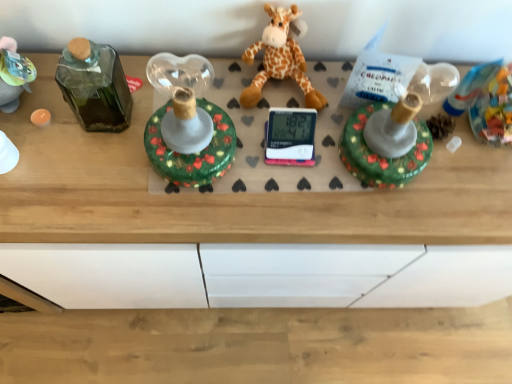
Identify the location of shiny green glass candlestick at center. (187, 123).

Describe the element at coordinates (187, 123) in the screenshot. The width and height of the screenshot is (512, 384). I see `shiny green glass candlestick at center` at that location.

The width and height of the screenshot is (512, 384). What do you see at coordinates (280, 59) in the screenshot? I see `soft plush giraffe at center` at bounding box center [280, 59].

Where is `soft plush giraffe at center`? This screenshot has width=512, height=384. soft plush giraffe at center is located at coordinates (280, 59).

Measure the distance between soft plush giraffe at center and camera.

A distance of 83.45 centimeters exists between soft plush giraffe at center and camera.

You are a GUI agent. You are given a task and a screenshot of the screen. Output one action in this format:
    pyautogui.click(x=<x>, y=<y>)
    Task: Click on the shiny green glass candlestick at center
    Image resolution: width=512 pixels, height=384 pixels.
    Given the screenshot: What is the action you would take?
    pyautogui.click(x=187, y=123)

Consider the image. Which is more to the right, soft plush giraffe at center or shiny green glass candlestick at center?

Positioned to the right is soft plush giraffe at center.

Considering the relative positions of soft plush giraffe at center and shiny green glass candlestick at center in the image provided, is soft plush giraffe at center behind shiny green glass candlestick at center?

Yes, it is.

Is point (260, 42) positioned before point (151, 117)?

No, (260, 42) is further to viewer.

From the image's perspective, is soft plush giraffe at center above or below shiny green glass candlestick at center?

soft plush giraffe at center is above shiny green glass candlestick at center.

From a real-world perspective, is soft plush giraffe at center on shiny green glass candlestick at center?

No, from a real-world perspective, soft plush giraffe at center is not above shiny green glass candlestick at center.

Can you confirm if soft plush giraffe at center is thinner than shiny green glass candlestick at center?

Correct, the width of soft plush giraffe at center is less than that of shiny green glass candlestick at center.

Who is shorter, soft plush giraffe at center or shiny green glass candlestick at center?

Standing shorter between the two is soft plush giraffe at center.

Considering the sizes of objects soft plush giraffe at center and shiny green glass candlestick at center in the image provided, who is bigger, soft plush giraffe at center or shiny green glass candlestick at center?

shiny green glass candlestick at center is bigger.

Is shiny green glass candlestick at center located within soft plush giraffe at center?

That's incorrect, shiny green glass candlestick at center is not inside soft plush giraffe at center.

Looking at this image, are soft plush giraffe at center and shiny green glass candlestick at center located far from each other?

No.

Does soft plush giraffe at center turn towards shiny green glass candlestick at center?

No, soft plush giraffe at center does not turn towards shiny green glass candlestick at center.

Can you tell me how much soft plush giraffe at center and shiny green glass candlestick at center differ in facing direction?

They differ by 0.000141 degrees in their facing directions.

At what (x,y) coordinates should I click in order to perform the action: click on toy located below the soft plush giraffe at center (from the image's perspective). Please return your answer as a coordinate pair (x, y). This screenshot has width=512, height=384. Looking at the image, I should click on (187, 123).

Considering the relative positions of shiny green glass candlestick at center and soft plush giraffe at center in the image provided, is shiny green glass candlestick at center to the left or to the right of soft plush giraffe at center?

From the image, it's evident that shiny green glass candlestick at center is to the left of soft plush giraffe at center.

From the picture: Is shiny green glass candlestick at center closer to the viewer compared to soft plush giraffe at center?

Yes, it is.

Is point (164, 82) farther from viewer compared to point (279, 55)?

No, it is not.

From the image's perspective, is shiny green glass candlestick at center above soft plush giraffe at center?

No.

From a real-world perspective, relative to soft plush giraffe at center, is shiny green glass candlestick at center vertically above or below?

Clearly, from a real-world perspective, shiny green glass candlestick at center is above soft plush giraffe at center.

Between shiny green glass candlestick at center and soft plush giraffe at center, which one has larger width?

shiny green glass candlestick at center.

Is shiny green glass candlestick at center taller than soft plush giraffe at center?

Indeed, shiny green glass candlestick at center has a greater height compared to soft plush giraffe at center.

In the scene shown: Can you confirm if shiny green glass candlestick at center is smaller than soft plush giraffe at center?

Actually, shiny green glass candlestick at center might be larger than soft plush giraffe at center.

Based on the photo, is shiny green glass candlestick at center not within soft plush giraffe at center?

Yes, shiny green glass candlestick at center is outside of soft plush giraffe at center.

Is shiny green glass candlestick at center touching soft plush giraffe at center?

No.

Could you tell me if shiny green glass candlestick at center is facing soft plush giraffe at center?

No, shiny green glass candlestick at center is not turned towards soft plush giraffe at center.

Can you tell me how much shiny green glass candlestick at center and soft plush giraffe at center differ in facing direction?

The facing directions of shiny green glass candlestick at center and soft plush giraffe at center are 0.000141 degrees apart.

In order to click on giraffe located underneath the shiny green glass candlestick at center (from a real-world perspective) in this screenshot , I will do `click(280, 59)`.

At what (x,y) coordinates should I click in order to perform the action: click on toy on the left of soft plush giraffe at center. Please return your answer as a coordinate pair (x, y). Looking at the image, I should click on (187, 123).

At what (x,y) coordinates should I click in order to perform the action: click on toy in front of the soft plush giraffe at center. Please return your answer as a coordinate pair (x, y). The image size is (512, 384). Looking at the image, I should click on (187, 123).